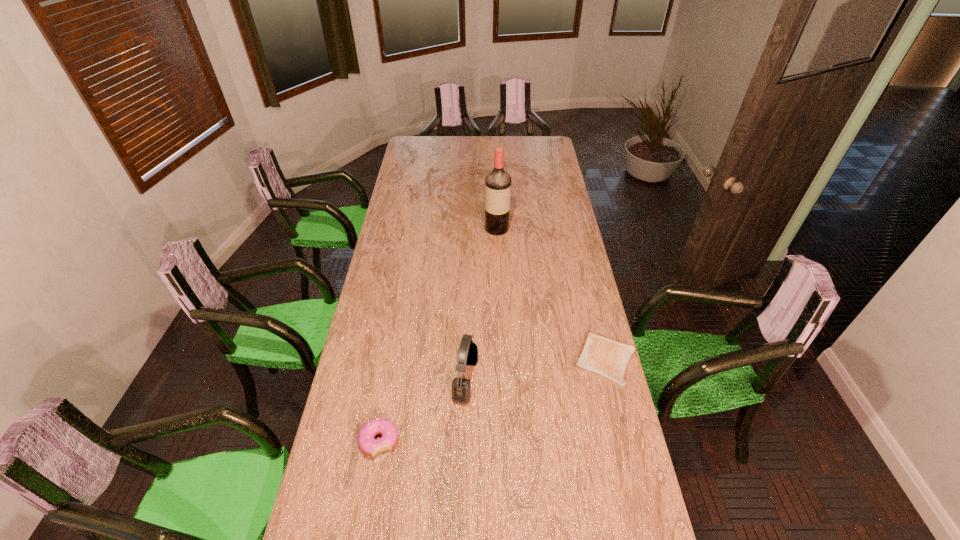
Find the location of a particular element. This screenshot has width=960, height=540. empty location between the rightmost object and the third tallest object is located at coordinates (492, 400).

Find the location of `empty space between the rightmost object and the third object from right to left`. empty space between the rightmost object and the third object from right to left is located at coordinates (535, 369).

Locate an element on the screen. Image resolution: width=960 pixels, height=540 pixels. vacant point located between the headset and the farthest object is located at coordinates (481, 304).

Image resolution: width=960 pixels, height=540 pixels. I want to click on the second closest object to the third object from left to right, so click(x=468, y=351).

Locate an element on the screen. The image size is (960, 540). object that is the third closest to the nearest object is located at coordinates (497, 182).

What are the coordinates of `free space that satisfies the following two spatial constraints: 1. on the back side of the toast; 2. on the right side of the headset` in the screenshot? It's located at (467, 360).